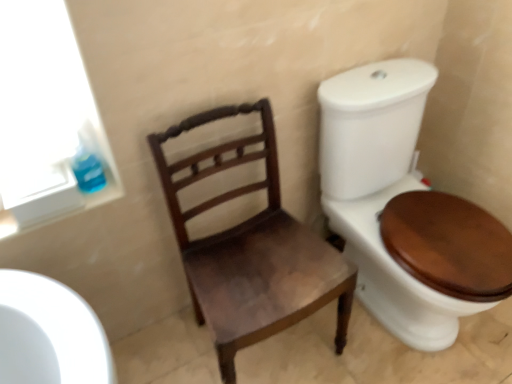
Locate an element on the screen. The width and height of the screenshot is (512, 384). mahogany wood chair at center is located at coordinates click(251, 249).

The height and width of the screenshot is (384, 512). What do you see at coordinates (251, 249) in the screenshot?
I see `mahogany wood chair at center` at bounding box center [251, 249].

Locate an element on the screen. This screenshot has height=384, width=512. blue glossy toilet paper at upper left is located at coordinates (88, 170).

What do you see at coordinates (88, 170) in the screenshot? I see `blue glossy toilet paper at upper left` at bounding box center [88, 170].

Where is `mahogany wood chair at center`? Image resolution: width=512 pixels, height=384 pixels. mahogany wood chair at center is located at coordinates (251, 249).

Is mahogany wood chair at center to the right of blue glossy toilet paper at upper left from the viewer's perspective?

Yes, mahogany wood chair at center is to the right of blue glossy toilet paper at upper left.

Considering the positions of objects mahogany wood chair at center and blue glossy toilet paper at upper left in the image provided, who is in front, mahogany wood chair at center or blue glossy toilet paper at upper left?

mahogany wood chair at center.

Is point (268, 313) positioned behind point (91, 189)?

No, (268, 313) is closer to viewer.

From the image's perspective, does mahogany wood chair at center appear higher than blue glossy toilet paper at upper left?

Incorrect, from the image's perspective, mahogany wood chair at center is lower than blue glossy toilet paper at upper left.

From a real-world perspective, is mahogany wood chair at center physically located above or below blue glossy toilet paper at upper left?

mahogany wood chair at center is situated lower than blue glossy toilet paper at upper left in the real world.

Can you confirm if mahogany wood chair at center is wider than blue glossy toilet paper at upper left?

Indeed, mahogany wood chair at center has a greater width compared to blue glossy toilet paper at upper left.

Who is shorter, mahogany wood chair at center or blue glossy toilet paper at upper left?

blue glossy toilet paper at upper left is shorter.

Looking at this image, considering the sizes of objects mahogany wood chair at center and blue glossy toilet paper at upper left in the image provided, who is smaller, mahogany wood chair at center or blue glossy toilet paper at upper left?

blue glossy toilet paper at upper left is smaller.

Is mahogany wood chair at center located outside blue glossy toilet paper at upper left?

Yes, mahogany wood chair at center is outside of blue glossy toilet paper at upper left.

Are mahogany wood chair at center and blue glossy toilet paper at upper left far apart?

No.

Is mahogany wood chair at center looking in the opposite direction of blue glossy toilet paper at upper left?

No, mahogany wood chair at center is not facing the opposite direction of blue glossy toilet paper at upper left.

You are a GUI agent. You are given a task and a screenshot of the screen. Output one action in this format:
    pyautogui.click(x=<x>, y=<y>)
    Task: Click on the toilet paper on the left side of mahogany wood chair at center
    The image size is (512, 384).
    Given the screenshot: What is the action you would take?
    pyautogui.click(x=88, y=170)

Does blue glossy toilet paper at upper left appear on the right side of mahogany wood chair at center?

In fact, blue glossy toilet paper at upper left is to the left of mahogany wood chair at center.

Does blue glossy toilet paper at upper left lie behind mahogany wood chair at center?

Yes, the depth of blue glossy toilet paper at upper left is greater than that of mahogany wood chair at center.

Which is further, (84, 160) or (191, 159)?

Point (191, 159)

In the scene shown: From the image's perspective, is blue glossy toilet paper at upper left positioned above or below mahogany wood chair at center?

blue glossy toilet paper at upper left is above mahogany wood chair at center.

From a real-world perspective, is blue glossy toilet paper at upper left physically above mahogany wood chair at center?

Yes, from a real-world perspective, blue glossy toilet paper at upper left is over mahogany wood chair at center

Considering the relative sizes of blue glossy toilet paper at upper left and mahogany wood chair at center in the image provided, is blue glossy toilet paper at upper left wider than mahogany wood chair at center?

No.

In the scene shown: Is blue glossy toilet paper at upper left taller than mahogany wood chair at center?

Incorrect, the height of blue glossy toilet paper at upper left is not larger of that of mahogany wood chair at center.

Which of these two, blue glossy toilet paper at upper left or mahogany wood chair at center, is bigger?

A: Bigger between the two is mahogany wood chair at center.

Is blue glossy toilet paper at upper left inside the boundaries of mahogany wood chair at center, or outside?

blue glossy toilet paper at upper left exists outside the volume of mahogany wood chair at center.

Is blue glossy toilet paper at upper left positioned far away from mahogany wood chair at center?

They are positioned close to each other.

Is blue glossy toilet paper at upper left aimed at mahogany wood chair at center?

No, blue glossy toilet paper at upper left is not turned towards mahogany wood chair at center.

What's the angular difference between blue glossy toilet paper at upper left and mahogany wood chair at center's facing directions?

The angular difference between blue glossy toilet paper at upper left and mahogany wood chair at center is 3.38 degrees.

Measure the distance from blue glossy toilet paper at upper left to mahogany wood chair at center.

blue glossy toilet paper at upper left and mahogany wood chair at center are 19.26 inches apart from each other.

Find the location of `chair in front of the blue glossy toilet paper at upper left`. chair in front of the blue glossy toilet paper at upper left is located at coordinates (251, 249).

Where is `chair located in front of the blue glossy toilet paper at upper left`? The width and height of the screenshot is (512, 384). chair located in front of the blue glossy toilet paper at upper left is located at coordinates [x=251, y=249].

This screenshot has height=384, width=512. Find the location of `chair below the blue glossy toilet paper at upper left (from the image's perspective)`. chair below the blue glossy toilet paper at upper left (from the image's perspective) is located at coordinates (251, 249).